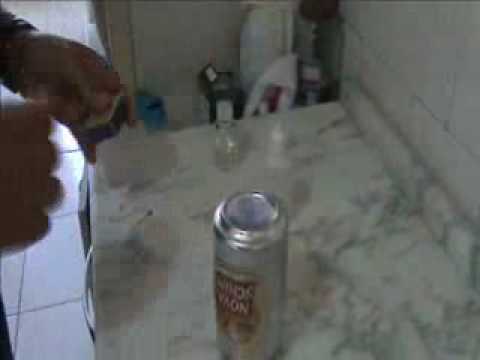
Find the location of a particular element. The image size is (480, 360). counter top is located at coordinates 344,256.